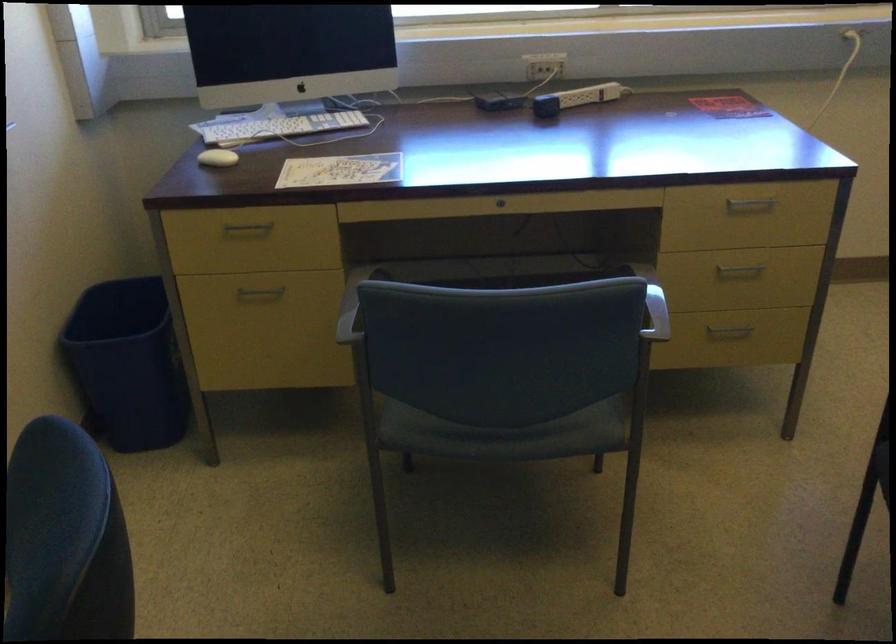
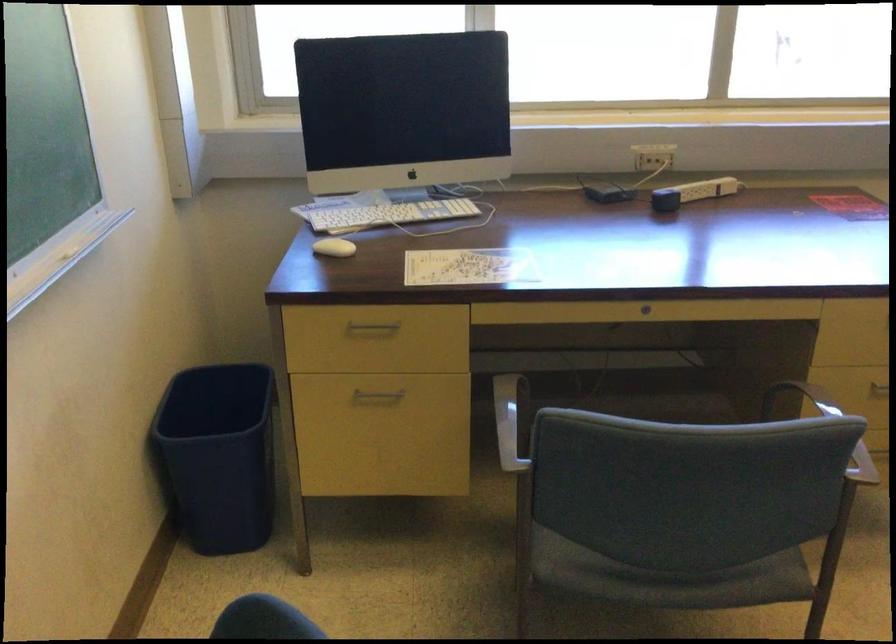
In the second image, find the point that corresponds to the point at 575,100 in the first image.

(692, 193)